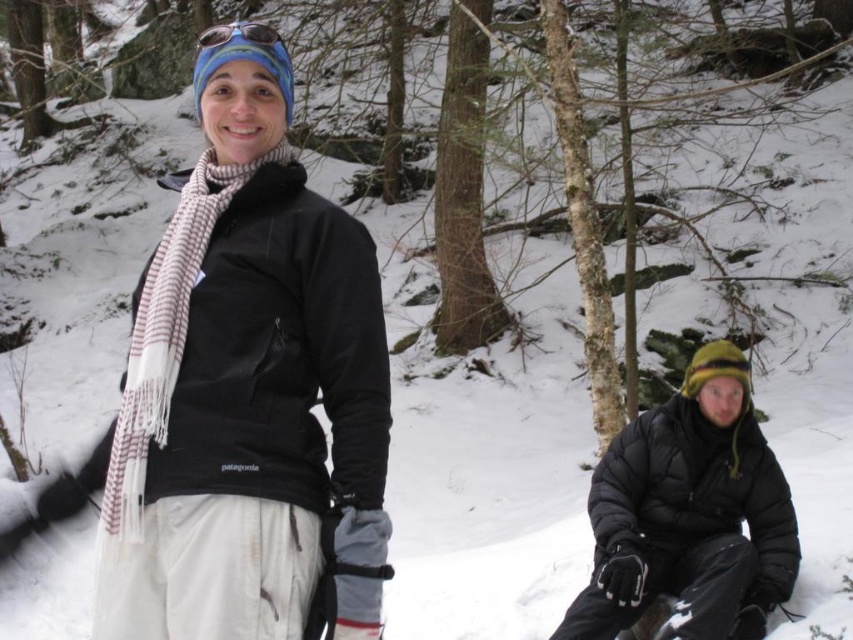
Question: Which point is closer to the camera?

Choices:
 (A) (357, 273)
 (B) (213, 36)

Answer: (A)

Question: Does black puffy jacket at lower right have a larger size compared to matte black goggles at upper center?

Choices:
 (A) yes
 (B) no

Answer: (A)

Question: Which object appears closest to the camera in this image?

Choices:
 (A) matte black goggles at upper center
 (B) white striped scarf at center

Answer: (B)

Question: Can you confirm if white striped scarf at center is positioned below matte black goggles at upper center?

Choices:
 (A) no
 (B) yes

Answer: (B)

Question: Is black fleece jacket at center wider than black puffy jacket at lower right?

Choices:
 (A) no
 (B) yes

Answer: (A)

Question: Based on their relative distances, which object is farther from the matte black goggles at upper center?

Choices:
 (A) white striped scarf at center
 (B) black puffy jacket at lower right

Answer: (B)